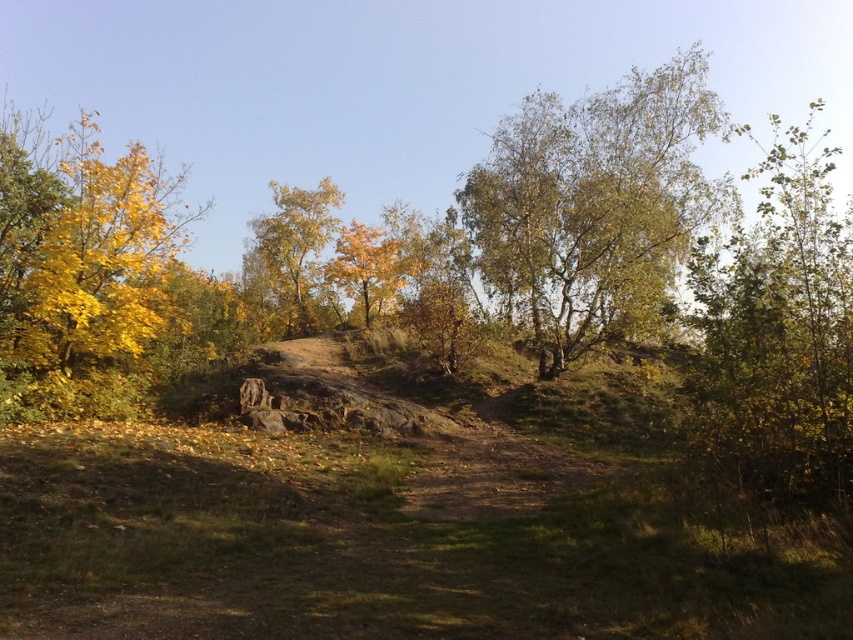
Question: Is green leafy tree at right behind yellow matte tree at center?

Choices:
 (A) no
 (B) yes

Answer: (A)

Question: Which object is the closest to the golden textured tree at center?

Choices:
 (A) green leafy tree at center
 (B) yellow matte tree at center
 (C) golden leafy tree at left
 (D) green leafy tree at right

Answer: (B)

Question: Can you confirm if green leafy tree at center is positioned to the right of yellow matte tree at center?

Choices:
 (A) no
 (B) yes

Answer: (B)

Question: Which of the following is the closest to the observer?

Choices:
 (A) (347, 273)
 (B) (305, 301)

Answer: (A)

Question: Among these points, which one is nearest to the camera?

Choices:
 (A) (585, 214)
 (B) (57, 193)
 (C) (704, 275)

Answer: (C)

Question: From the image, what is the correct spatial relationship of green leafy tree at right in relation to golden textured tree at center?

Choices:
 (A) right
 (B) left

Answer: (A)